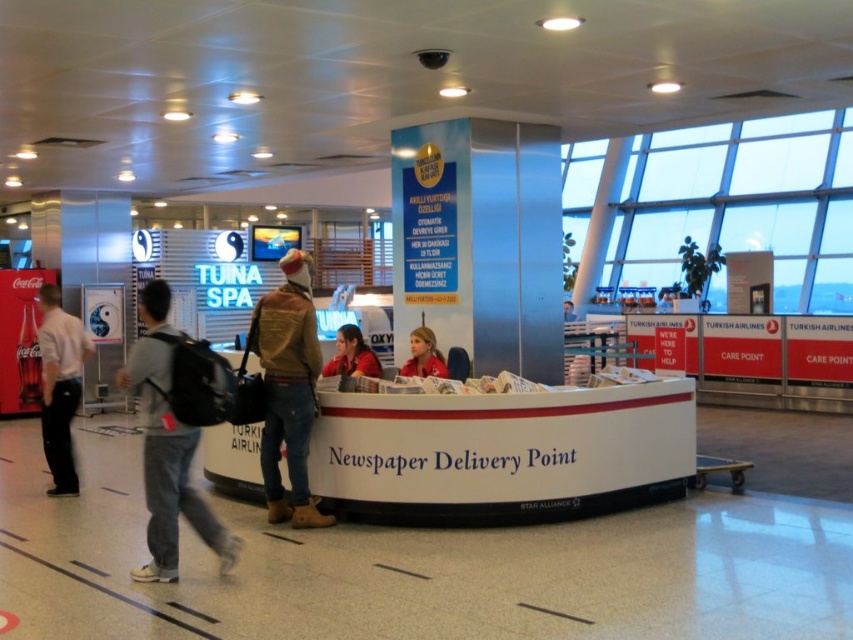
Based on the photo, does black backpack at left have a lesser height compared to matte black backpack at left?

Indeed, black backpack at left has a lesser height compared to matte black backpack at left.

Looking at this image, who is lower down, black backpack at left or matte black backpack at left?

black backpack at left is lower down.

The image size is (853, 640). What are the coordinates of `black backpack at left` in the screenshot? It's located at (177, 432).

I want to click on matte black backpack at left, so 61,385.

Which is behind, point (80, 352) or point (567, 321)?

The point (567, 321) is more distant.

Which is behind, point (67, 444) or point (563, 316)?

The point (563, 316) is behind.

This screenshot has height=640, width=853. Find the location of `matte black backpack at left`. matte black backpack at left is located at coordinates pyautogui.click(x=61, y=385).

Between matte black backpack at left and red shirt at center, which one appears on the left side from the viewer's perspective?

matte black backpack at left is more to the left.

Does matte black backpack at left have a greater width compared to red shirt at center?

No.

Who is more distant from viewer, [68,420] or [358,349]?

The point [68,420] is more distant.

Where is `matte black backpack at left`? matte black backpack at left is located at coordinates (61, 385).